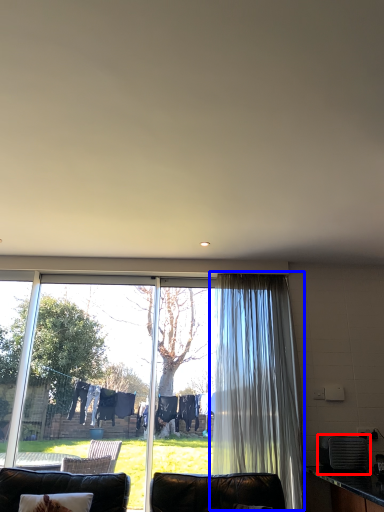
Question: Which of the following is the closest to the observer, appliance (highlighted by a red box) or curtain (highlighted by a blue box)?

Choices:
 (A) appliance
 (B) curtain

Answer: (A)